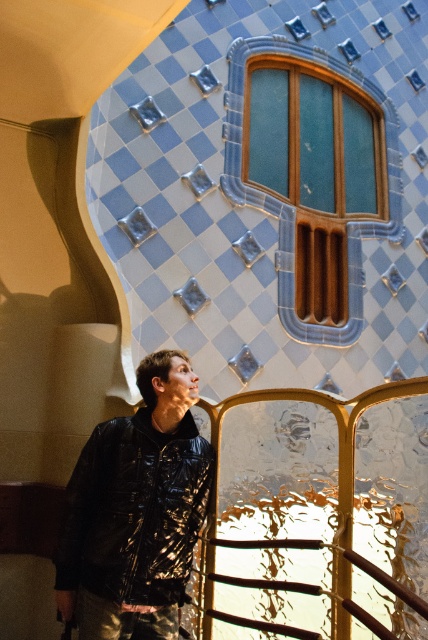
You are an interior designer assessing the space. You need to determine if the shiny black jacket at center can be seen through the teal glass window at upper center. Based on their positions, what is your conclusion?

The shiny black jacket at center is in front of the teal glass window at upper center, so it would block the view through the window, making the jacket visible from the outside but obscuring whatever is behind the window.

You are an interior designer assessing the space. You need to determine if a new decorative shelf, which is as wide as the shiny black jacket at center, can fit horizontally next to the teal glass window at upper center without overlapping. Can it fit?

The shiny black jacket at center has a lesser width compared to the teal glass window at upper center. Since the shelf is as wide as the shiny black jacket at center, it can fit horizontally next to the teal glass window at upper center without overlapping.